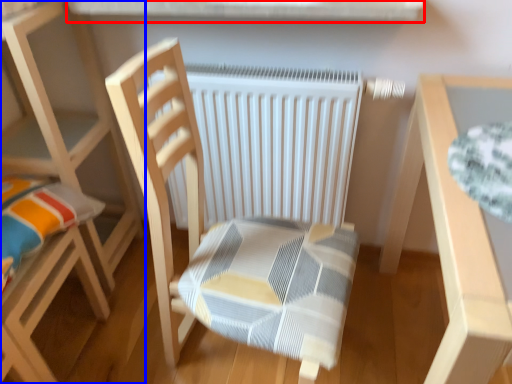
Question: Which object appears closest to the camera in this image, window sill (highlighted by a red box) or chair (highlighted by a blue box)?

Choices:
 (A) window sill
 (B) chair

Answer: (A)